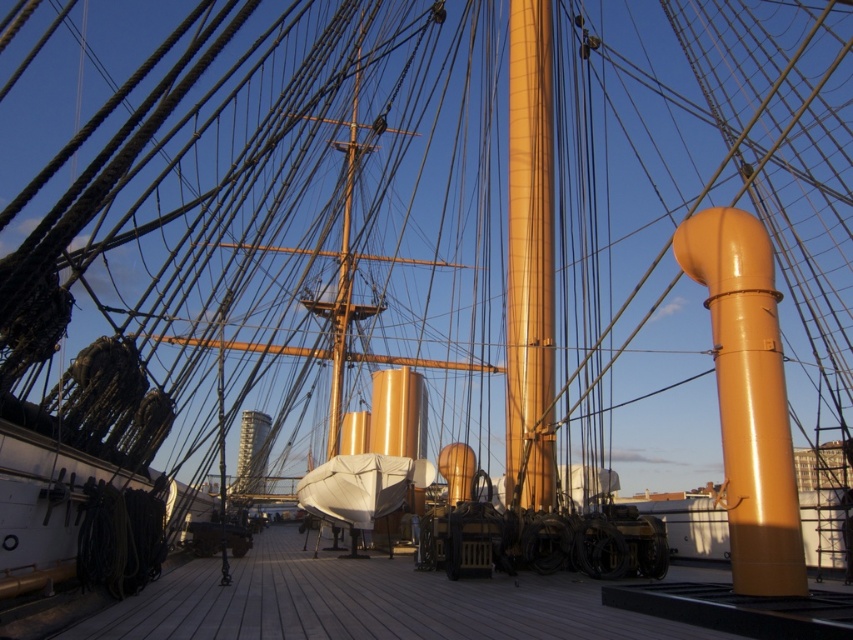
Does glossy orange pipe at right have a greater width compared to matte gold mast at center?

Yes, glossy orange pipe at right is wider than matte gold mast at center.

Which is above, glossy orange pipe at right or matte gold mast at center?

matte gold mast at center

Describe the element at coordinates (747, 396) in the screenshot. I see `glossy orange pipe at right` at that location.

Find the location of `glossy orange pipe at right`. glossy orange pipe at right is located at coordinates (747, 396).

Which is below, wooden at center or matte gold mast at center?

wooden at center is below.

Consider the image. Does wooden at center appear on the left side of matte gold mast at center?

Indeed, wooden at center is positioned on the left side of matte gold mast at center.

Does point (277, 563) come closer to viewer compared to point (517, 76)?

Yes.

Find the location of `wooden at center`. wooden at center is located at coordinates (364, 604).

Can you confirm if wooden at center is smaller than glossy orange pipe at right?

Incorrect, wooden at center is not smaller in size than glossy orange pipe at right.

Who is positioned more to the right, wooden at center or glossy orange pipe at right?

glossy orange pipe at right

Who is more distant from viewer, (161, 609) or (795, 524)?

Positioned behind is point (795, 524).

This screenshot has width=853, height=640. Find the location of `wooden at center`. wooden at center is located at coordinates (364, 604).